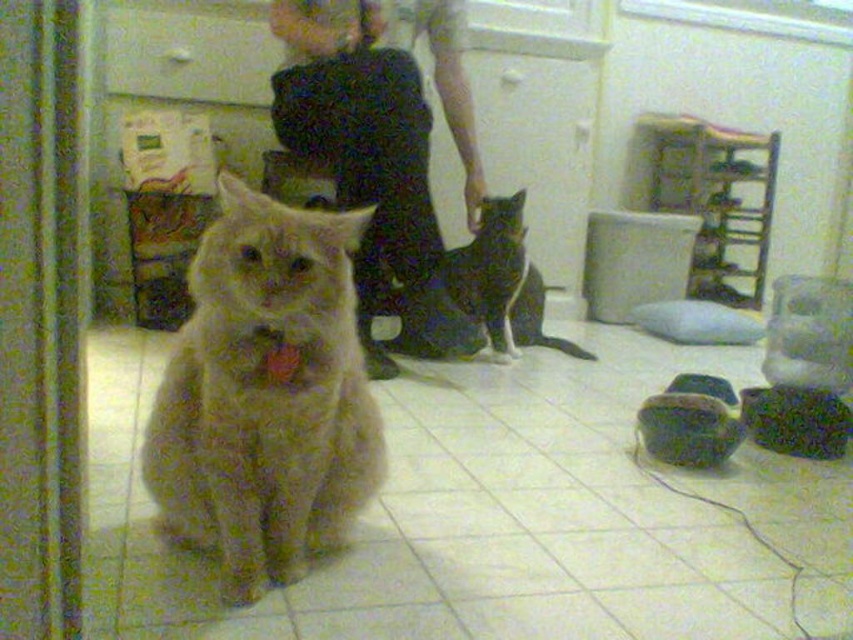
Question: Does fuzzy brown cat at center have a lesser width compared to black and white fur cat at center?

Choices:
 (A) yes
 (B) no

Answer: (B)

Question: Is black and white fur cat at center wider than fluffy orange cat at center?

Choices:
 (A) no
 (B) yes

Answer: (B)

Question: Which point is closer to the camera taking this photo?

Choices:
 (A) (387, 358)
 (B) (114, 61)

Answer: (A)

Question: From the image, what is the correct spatial relationship of fuzzy brown cat at center in relation to black and white fur cat at center?

Choices:
 (A) above
 (B) below

Answer: (B)

Question: Among these objects, which one is farthest from the camera?

Choices:
 (A) fuzzy brown cat at center
 (B) matte black pants at center
 (C) white matte drawer at upper center
 (D) black and white fur cat at center

Answer: (C)

Question: Which of the following is the farthest from the observer?

Choices:
 (A) (260, 228)
 (B) (277, 22)
 (C) (196, 16)
 (D) (506, 355)

Answer: (C)